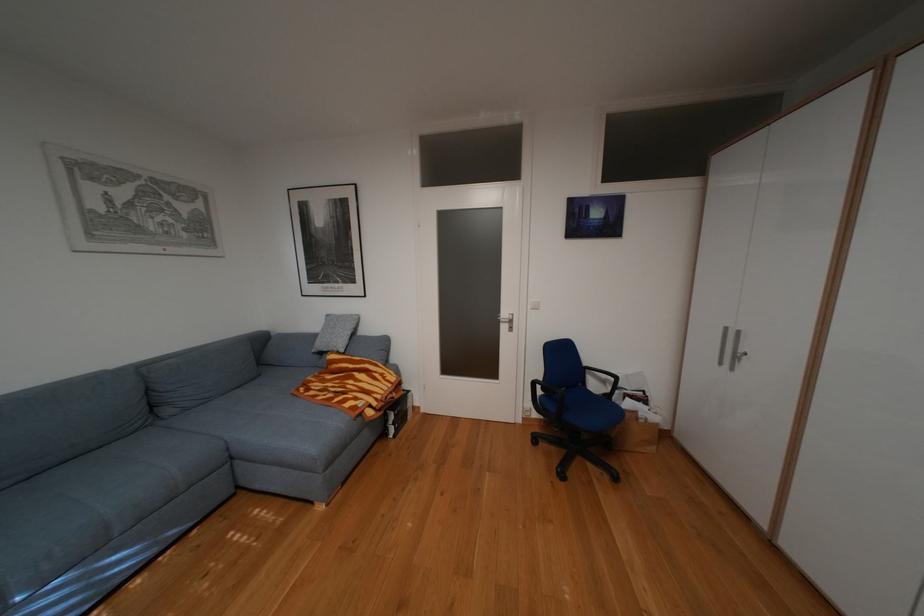
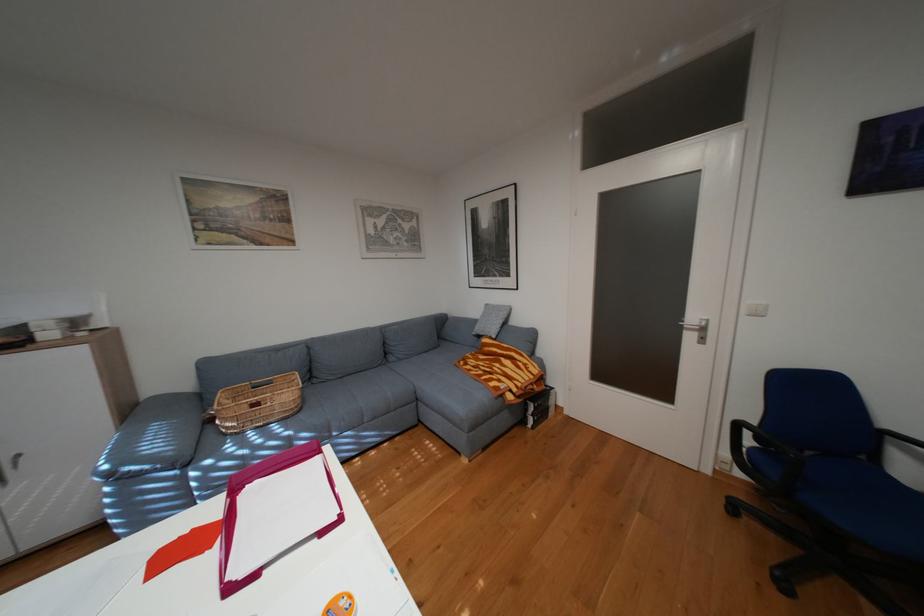
Question: How did the camera likely rotate?

Choices:
 (A) Left
 (B) Right
 (C) Up
 (D) Down

Answer: (A)